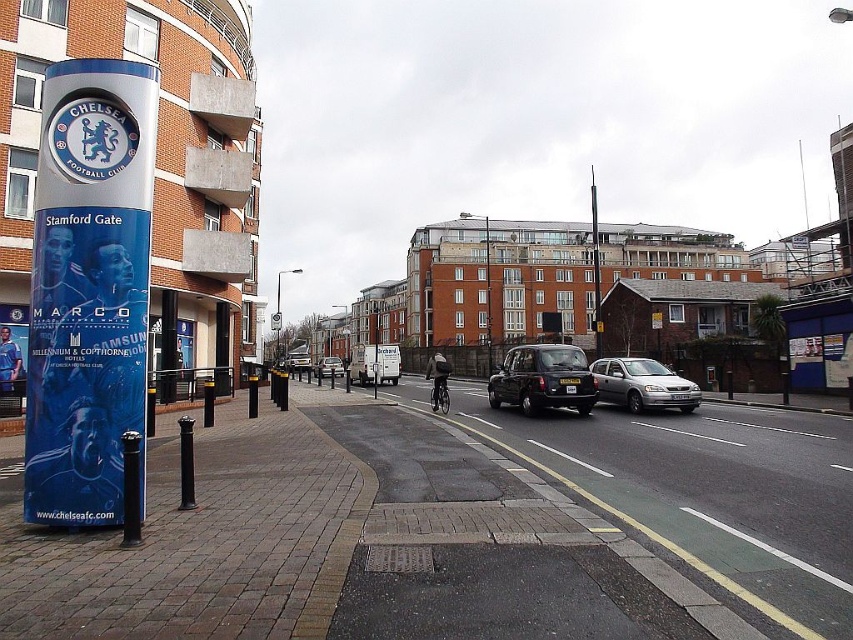
Question: Does black metallic taxi at center have a smaller size compared to smooth metallic pole at center?

Choices:
 (A) yes
 (B) no

Answer: (A)

Question: Does silver metallic hatchback at center have a larger size compared to silver metallic van at center?

Choices:
 (A) yes
 (B) no

Answer: (B)

Question: Can you confirm if black metallic taxi at center is smaller than silver metallic van at center?

Choices:
 (A) yes
 (B) no

Answer: (A)

Question: Among these objects, which one is nearest to the camera?

Choices:
 (A) silver metallic hatchback at center
 (B) silver metallic van at center

Answer: (A)

Question: Among these objects, which one is farthest from the camera?

Choices:
 (A) smooth metallic pole at center
 (B) black metallic taxi at center
 (C) silver metallic van at center
 (D) silver metallic hatchback at center

Answer: (C)

Question: Which point is farther to the camera?

Choices:
 (A) silver metallic hatchback at center
 (B) smooth metallic pole at center

Answer: (B)